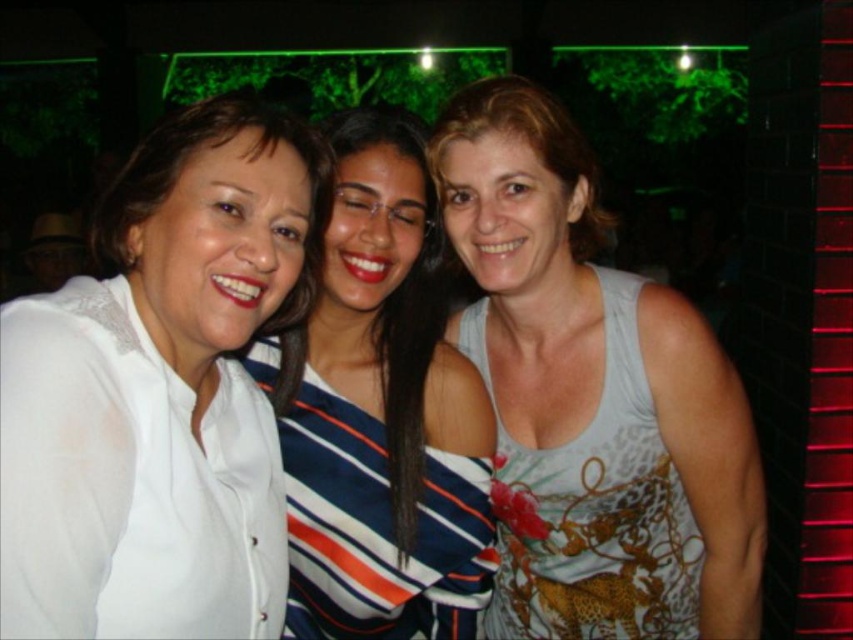
Between point (585, 376) and point (604, 516), which one is positioned behind?

The point (604, 516) is more distant.

Image resolution: width=853 pixels, height=640 pixels. Find the location of `white printed tank top at right`. white printed tank top at right is located at coordinates (592, 397).

This screenshot has height=640, width=853. What are the coordinates of `white printed tank top at right` in the screenshot? It's located at pos(592,397).

Is point (280, 124) in front of point (497, 448)?

Yes.

Does white sheer blouse at left have a greater width compared to printed fabric tank top at center?

No.

What do you see at coordinates (161, 392) in the screenshot? I see `white sheer blouse at left` at bounding box center [161, 392].

Identify the location of white sheer blouse at left. (161, 392).

Between white sheer blouse at left and white matte shirt at center, which one is positioned higher?

white sheer blouse at left is higher up.

Who is lower down, white sheer blouse at left or white matte shirt at center?

white matte shirt at center is below.

The height and width of the screenshot is (640, 853). I want to click on white sheer blouse at left, so click(x=161, y=392).

In order to click on white sheer blouse at left in this screenshot , I will do `click(161, 392)`.